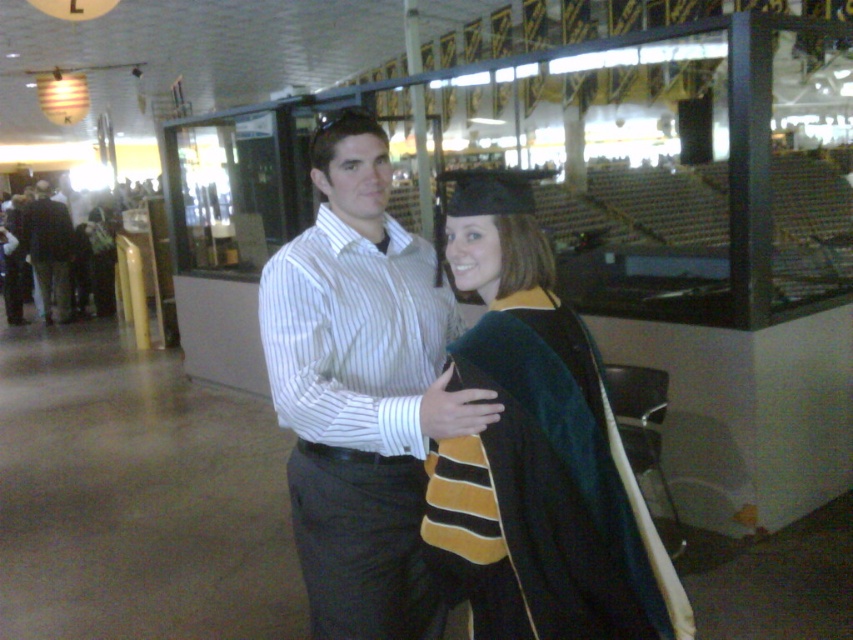
Between velvet black graduation gown at center and dark gray pants at left, which one is positioned higher?

Positioned higher is dark gray pants at left.

Who is more forward, (467, 451) or (67, 269)?

Positioned in front is point (467, 451).

This screenshot has height=640, width=853. I want to click on velvet black graduation gown at center, so click(x=538, y=449).

Between velvet black graduation gown at center and white striped shirt at center, which one has less height?

velvet black graduation gown at center is shorter.

Locate an element on the screen. Image resolution: width=853 pixels, height=640 pixels. velvet black graduation gown at center is located at coordinates (538, 449).

Locate an element on the screen. This screenshot has width=853, height=640. velvet black graduation gown at center is located at coordinates (538, 449).

Is white striped shirt at center behind dark gray pants at left?

No, it is in front of dark gray pants at left.

Who is positioned more to the left, white striped shirt at center or dark gray pants at left?

dark gray pants at left

In order to click on white striped shirt at center in this screenshot , I will do `click(361, 392)`.